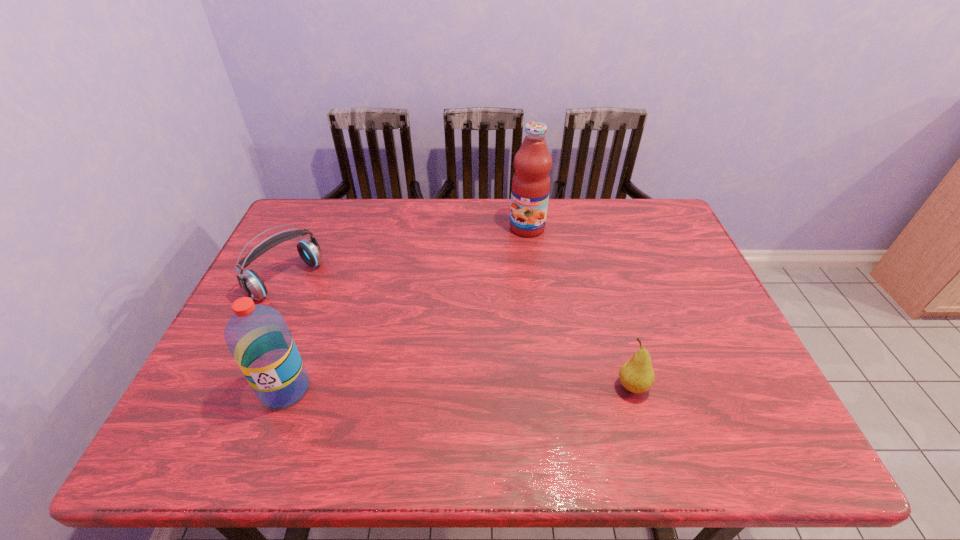
At what (x,y) coordinates should I click in order to perform the action: click on vacant region located on the front label of the fruit juice. Please return your answer as a coordinate pair (x, y). The image size is (960, 540). Looking at the image, I should click on (510, 252).

Image resolution: width=960 pixels, height=540 pixels. What are the coordinates of `vacant region located 0.270m on the front label of the fruit juice` in the screenshot? It's located at (482, 291).

Image resolution: width=960 pixels, height=540 pixels. Find the location of `object located in the far edge section of the desktop`. object located in the far edge section of the desktop is located at coordinates (530, 190).

You are a GUI agent. You are given a task and a screenshot of the screen. Output one action in this format:
    pyautogui.click(x=<x>, y=<y>)
    Task: Click on the water bottle that is positioned at the near edge
    The height and width of the screenshot is (540, 960).
    Given the screenshot: What is the action you would take?
    pyautogui.click(x=257, y=336)

Image resolution: width=960 pixels, height=540 pixels. What are the coordinates of `pear that is at the near edge` in the screenshot? It's located at (636, 375).

Find the location of `water bottle located in the left edge section of the desktop`. water bottle located in the left edge section of the desktop is located at coordinates (257, 336).

At what (x,y) coordinates should I click in order to perform the action: click on headset positioned at the left edge. Please return your answer as a coordinate pair (x, y). The width and height of the screenshot is (960, 540). Looking at the image, I should click on (251, 284).

The width and height of the screenshot is (960, 540). I want to click on object located in the near left corner section of the desktop, so click(257, 336).

Locate an element on the screen. This screenshot has width=960, height=540. vacant space at the far edge of the desktop is located at coordinates (356, 199).

This screenshot has height=540, width=960. In the image, there is a desktop. In order to click on vacant space at the near edge in this screenshot , I will do `click(634, 395)`.